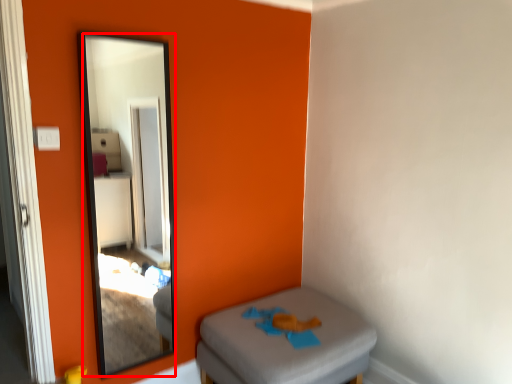
Question: From the image's perspective, where is mirror (annotated by the red box) located relative to furniture?

Choices:
 (A) above
 (B) below

Answer: (A)